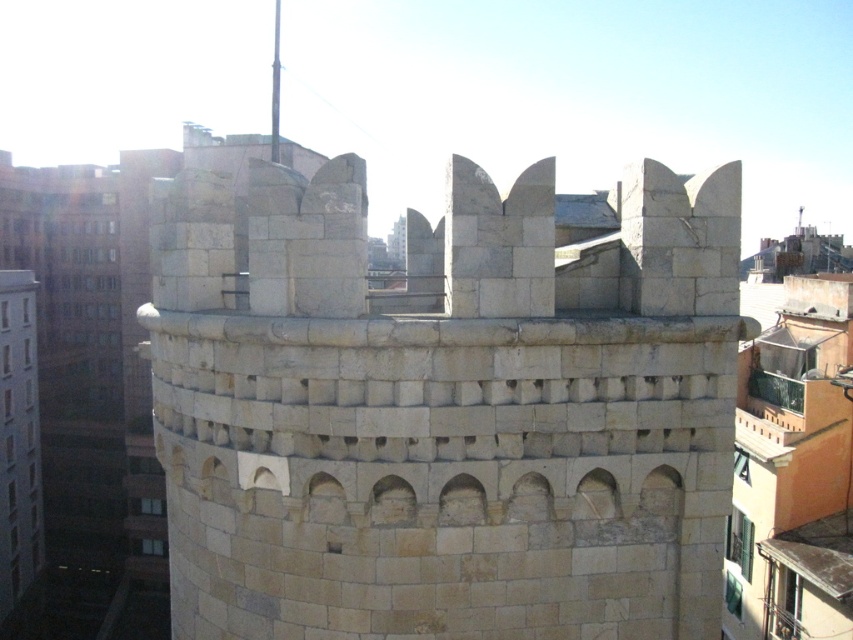
Question: Observing the image, what is the correct spatial positioning of white stone tower at center in reference to beige stone tower at left?

Choices:
 (A) left
 (B) right

Answer: (B)

Question: Among these points, which one is nearest to the camera?

Choices:
 (A) (195, 401)
 (B) (35, 413)

Answer: (A)

Question: Is white stone tower at center positioned at the back of beige stone tower at left?

Choices:
 (A) no
 (B) yes

Answer: (A)

Question: Which of the following is the farthest from the observer?

Choices:
 (A) (16, 550)
 (B) (440, 589)

Answer: (A)

Question: Which object is farther from the camera taking this photo?

Choices:
 (A) beige stone tower at left
 (B) white stone tower at center

Answer: (A)

Question: Where is white stone tower at center located in relation to beige stone tower at left in the image?

Choices:
 (A) left
 (B) right

Answer: (B)